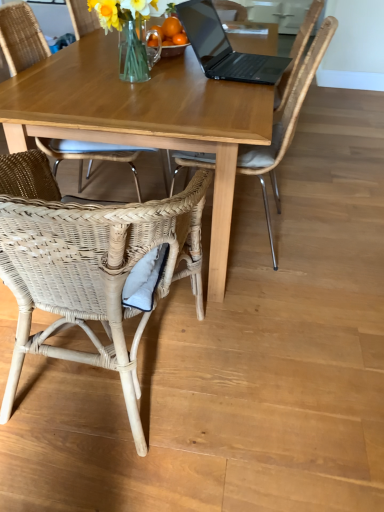
Locate an element on the screen. This screenshot has height=512, width=384. vacant space to the left of translucent glass vase at upper center is located at coordinates (69, 75).